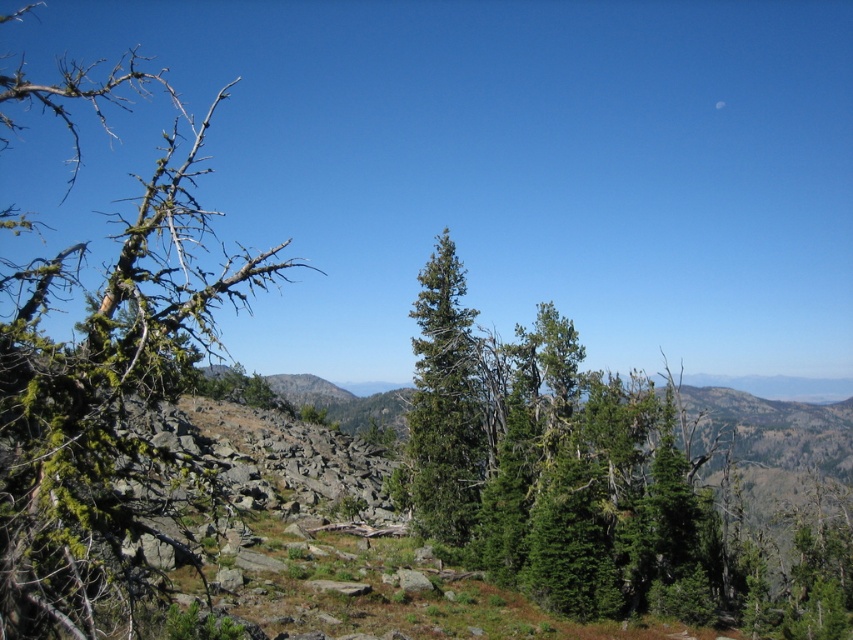
Is green mossy branch at left in front of green matte tree at center?

Yes, it is in front of green matte tree at center.

Who is more forward, (x=119, y=324) or (x=442, y=490)?

Point (x=119, y=324)

The height and width of the screenshot is (640, 853). What are the coordinates of `green mossy branch at left` in the screenshot? It's located at (103, 385).

Can you confirm if green matte evergreen tree at center is positioned to the right of green matte tree at center?

Correct, you'll find green matte evergreen tree at center to the right of green matte tree at center.

Does green matte evergreen tree at center have a greater width compared to green matte tree at center?

Yes.

What do you see at coordinates (589, 483) in the screenshot? I see `green matte evergreen tree at center` at bounding box center [589, 483].

What are the coordinates of `green matte evergreen tree at center` in the screenshot? It's located at (589, 483).

Between green matte evergreen tree at center and green mossy branch at left, which one appears on the left side from the viewer's perspective?

From the viewer's perspective, green mossy branch at left appears more on the left side.

Does point (718, 570) lie in front of point (169, 388)?

No, (718, 570) is further to viewer.

Measure the distance between point (718,605) and camera.

Point (718,605) is 38.71 meters from camera.

Locate an element on the screen. This screenshot has height=640, width=853. green matte evergreen tree at center is located at coordinates (589, 483).